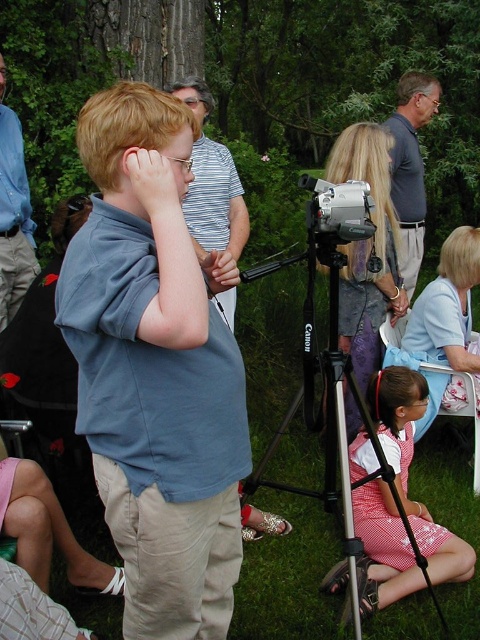
Between silver metallic tripod at lower center and striped cotton shirt at center, which one appears on the right side from the viewer's perspective?

From the viewer's perspective, silver metallic tripod at lower center appears more on the right side.

Does silver metallic tripod at lower center have a smaller size compared to striped cotton shirt at center?

Correct, silver metallic tripod at lower center occupies less space than striped cotton shirt at center.

Which is behind, point (273, 444) or point (237, 234)?

Positioned behind is point (237, 234).

Where is `silver metallic tripod at lower center`? silver metallic tripod at lower center is located at coordinates (453, 563).

Consider the image. Does polka dot dress at lower right appear over silver metallic tripod at lower center?

Actually, polka dot dress at lower right is below silver metallic tripod at lower center.

Is point (385, 497) more distant than point (450, 580)?

Yes, it is behind point (450, 580).

Is point (403, 563) in front of point (450, 257)?

Yes, it is.

Find the location of a particular element. The width and height of the screenshot is (480, 640). polka dot dress at lower right is located at coordinates (408, 467).

The height and width of the screenshot is (640, 480). What do you see at coordinates (215, 200) in the screenshot?
I see `striped cotton shirt at center` at bounding box center [215, 200].

You are a GUI agent. You are given a task and a screenshot of the screen. Output one action in this format:
    pyautogui.click(x=<x>, y=<y>)
    Task: Click on the striped cotton shirt at center
    The height and width of the screenshot is (640, 480).
    Given the screenshot: What is the action you would take?
    pyautogui.click(x=215, y=200)

Is point (220, 198) farther from camera compared to point (349, 221)?

Yes, point (220, 198) is behind point (349, 221).

Identify the location of striped cotton shirt at center. (215, 200).